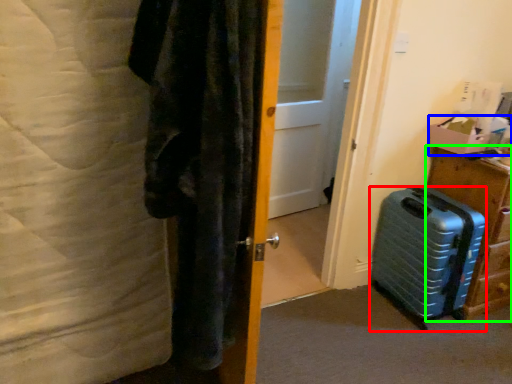
Question: Estimate the real-world distances between objects in this image. Which object is farther from suitcase (highlighted by a red box), box (highlighted by a blue box) or furniture (highlighted by a green box)?

Choices:
 (A) box
 (B) furniture

Answer: (A)